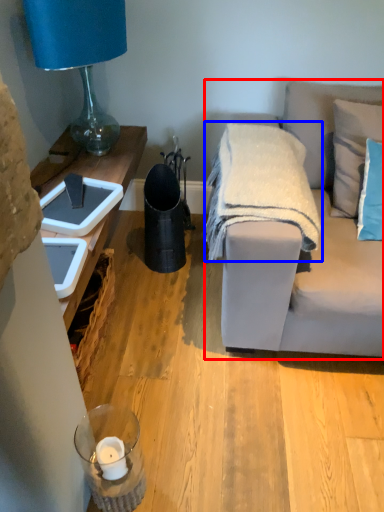
Question: Which of the following is the farthest to the observer, studio couch (highlighted by a red box) or blanket (highlighted by a blue box)?

Choices:
 (A) studio couch
 (B) blanket

Answer: (B)